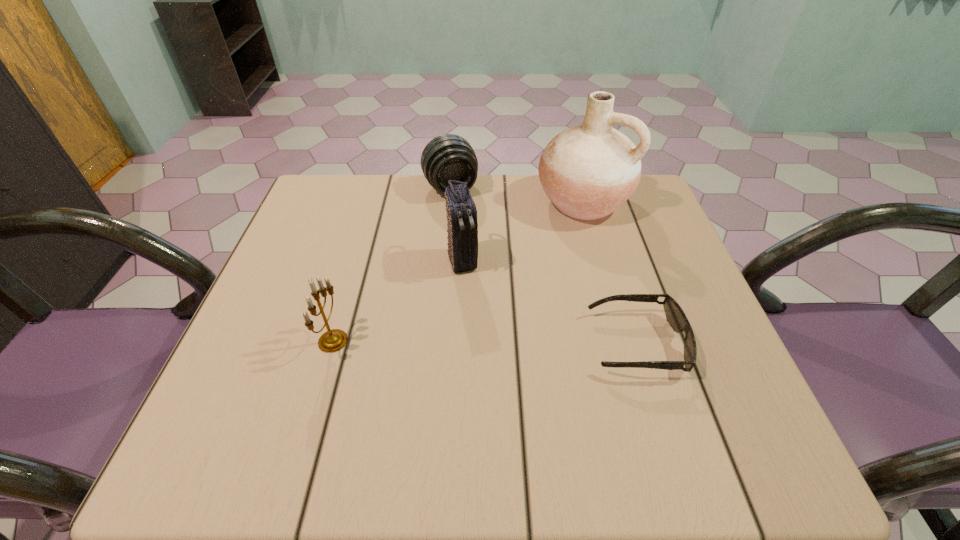
Identify the location of candelabrum. (333, 340).

Find the location of `sunglasses`. sunglasses is located at coordinates (675, 316).

The width and height of the screenshot is (960, 540). In order to click on the tallest object in this screenshot , I will do `click(588, 171)`.

At what (x,y) coordinates should I click in order to perform the action: click on the fourth tallest object. Please return your answer as a coordinate pair (x, y). Looking at the image, I should click on (447, 157).

Locate an element on the screen. the third nearest object is located at coordinates (462, 225).

This screenshot has height=540, width=960. Identify the location of blank area located 0.060m on the left of the leftmost object. 288,341.

The image size is (960, 540). I want to click on blank space located on the front-facing side of the sunglasses, so click(534, 343).

Identify the location of free location located 0.200m on the front-facing side of the sunglasses. This screenshot has height=540, width=960. (487, 343).

Where is `vacant region located on the front-facing side of the sunglasses`? This screenshot has height=540, width=960. vacant region located on the front-facing side of the sunglasses is located at coordinates (455, 343).

Locate an element on the screen. Image resolution: width=960 pixels, height=540 pixels. free space located to pour from the handle of the tallest object is located at coordinates (474, 323).